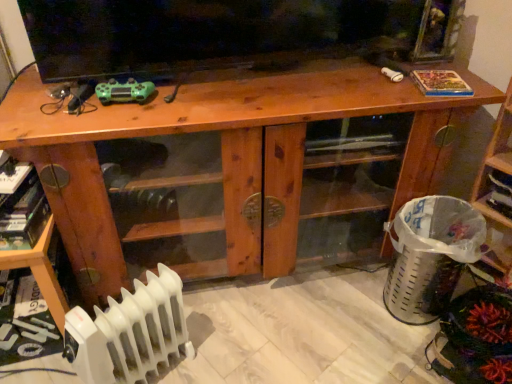
Locate an element on the screen. This screenshot has height=384, width=512. vacant point to the right of green matte controller at upper left is located at coordinates (187, 102).